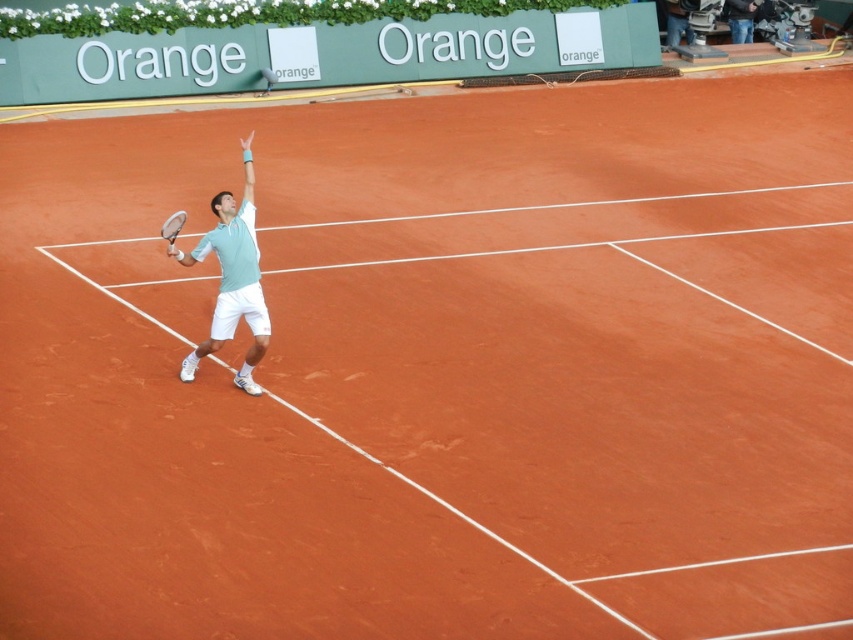
You are a sports analyst trying to determine the exact position of the light blue fabric shirt at center during a tennis match. What are the coordinates indicating its location?

The light blue fabric shirt at center is positioned at coordinates point (x=231, y=278).